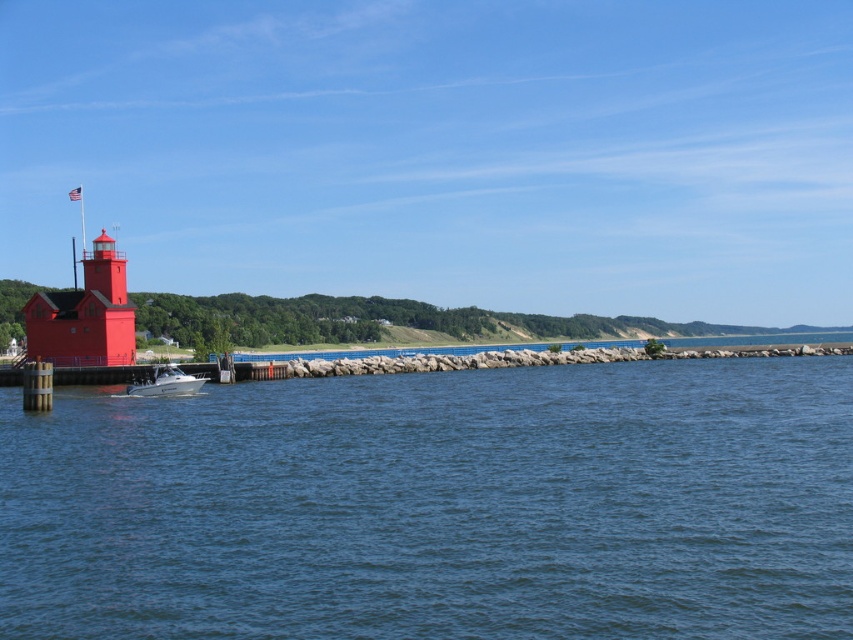
You are a GUI agent. You are given a task and a screenshot of the screen. Output one action in this format:
    pyautogui.click(x=<x>, y=<y>)
    Task: Click on the matte red lighthouse at left
    
    Given the screenshot: What is the action you would take?
    pyautogui.click(x=85, y=314)

Who is positioned more to the right, matte red lighthouse at left or white glossy boat at lower left?

Positioned to the right is white glossy boat at lower left.

Which is behind, point (53, 346) or point (172, 364)?

Point (172, 364)

Locate an element on the screen. The image size is (853, 640). matte red lighthouse at left is located at coordinates (85, 314).

Is blue water at center to the left of white glossy boat at lower left from the viewer's perspective?

No, blue water at center is not to the left of white glossy boat at lower left.

How distant is blue water at center from white glossy boat at lower left?

They are 12.54 meters apart.

Image resolution: width=853 pixels, height=640 pixels. Identify the location of blue water at center. pos(439,506).

Does blue water at center have a larger size compared to matte red lighthouse at left?

Actually, blue water at center might be smaller than matte red lighthouse at left.

Can you confirm if blue water at center is thinner than matte red lighthouse at left?

Correct, blue water at center's width is less than matte red lighthouse at left's.

Where is `blue water at center`? The image size is (853, 640). blue water at center is located at coordinates (439, 506).